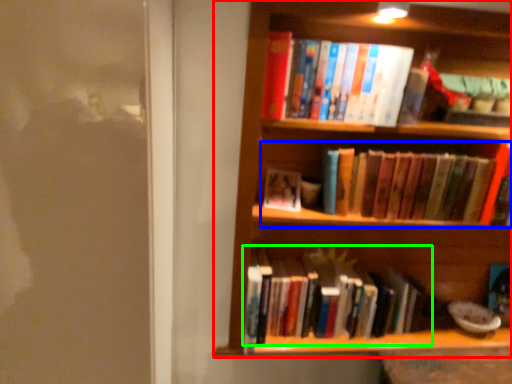
Question: Which object is the farthest from shelf (highlighted by a red box)? Choose among these: book (highlighted by a blue box) or book (highlighted by a green box).

Choices:
 (A) book
 (B) book

Answer: (B)